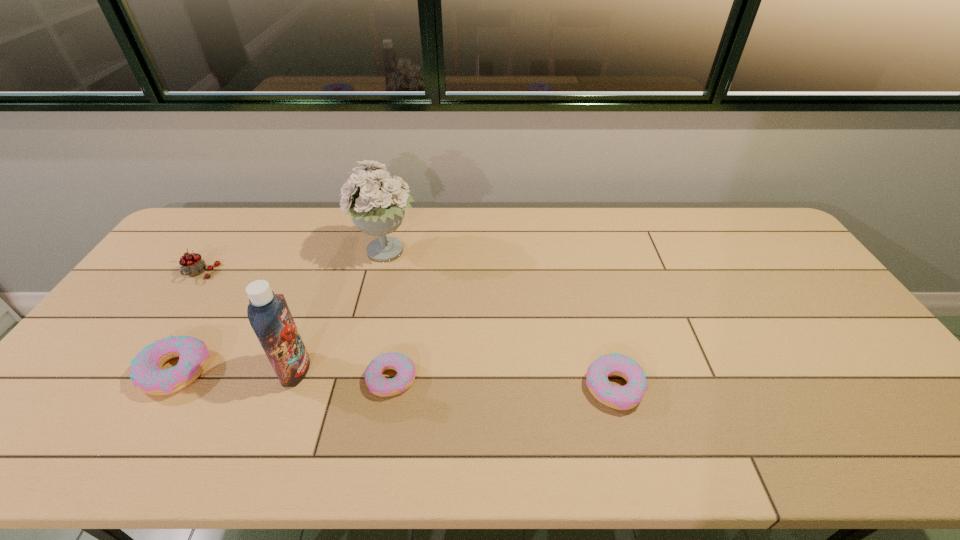
You are a GUI agent. You are given a task and a screenshot of the screen. Output one action in this format:
    pyautogui.click(x=<x>, y=<y>)
    Task: Click on the vacant space that satisfies the following two spatial constraints: 1. on the front label of the shampoo; 2. on the right side of the rightmost object
    
    Given the screenshot: What is the action you would take?
    pyautogui.click(x=289, y=387)